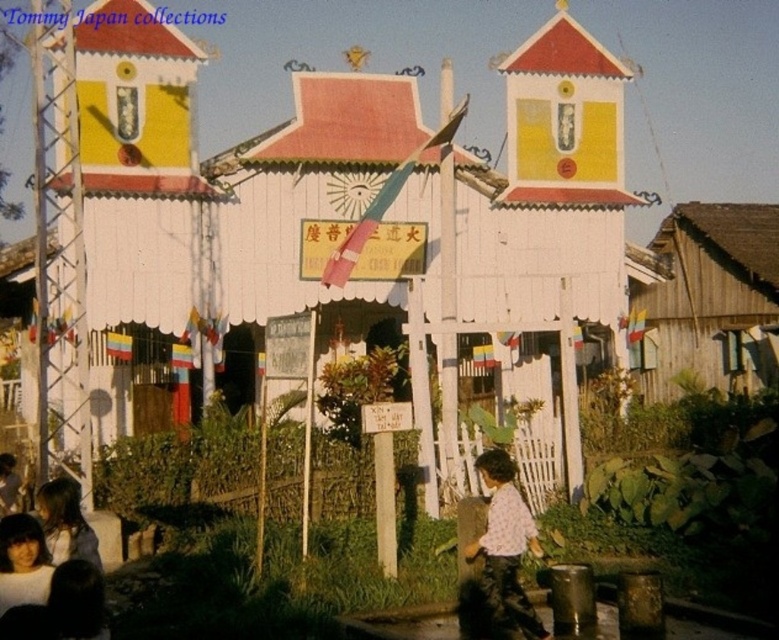
You are standing in front of the pavilion and want to know which object is wider between the white wood hut at center and the light brown hair at lower left. Can you tell me?

The white wood hut at center is wider than the light brown hair at lower left.

You are standing in front of the white wood hut at center and want to see the light brown hair at lower left. Can you see it without moving your head?

The light brown hair at lower left is behind the white wood hut at center, so you cannot see it without moving your head.